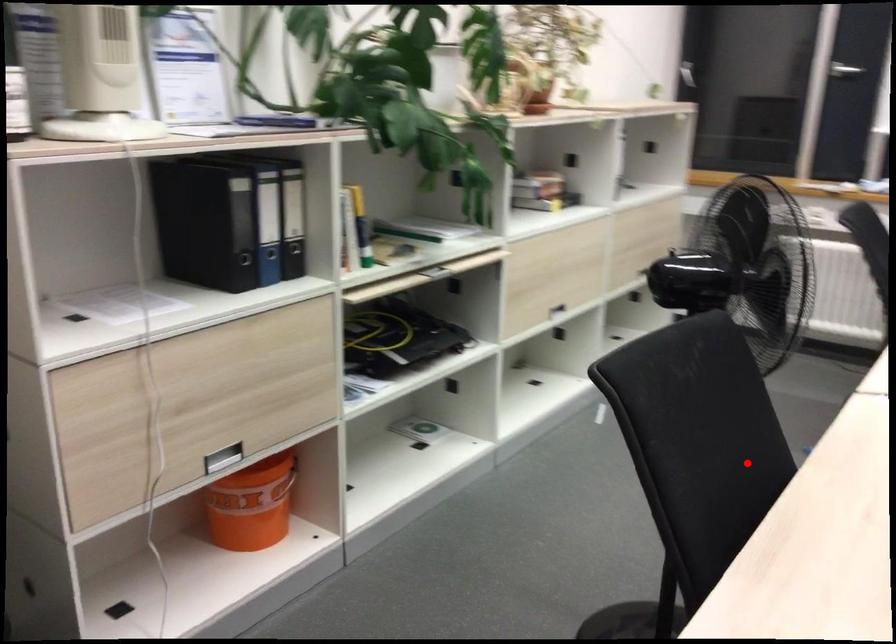
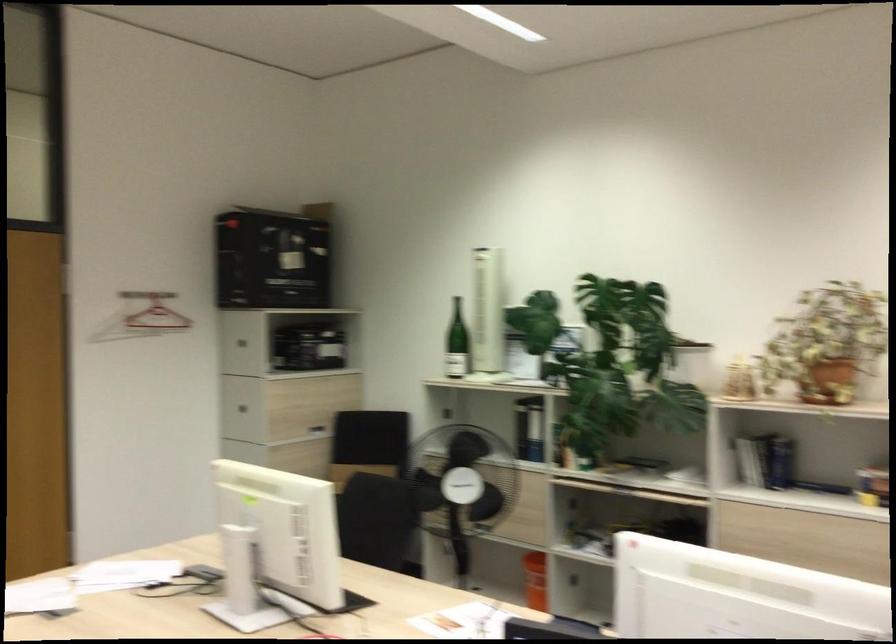
Locate, in the second image, the point that corresponds to the highlighted location in the first image.

(376, 520)